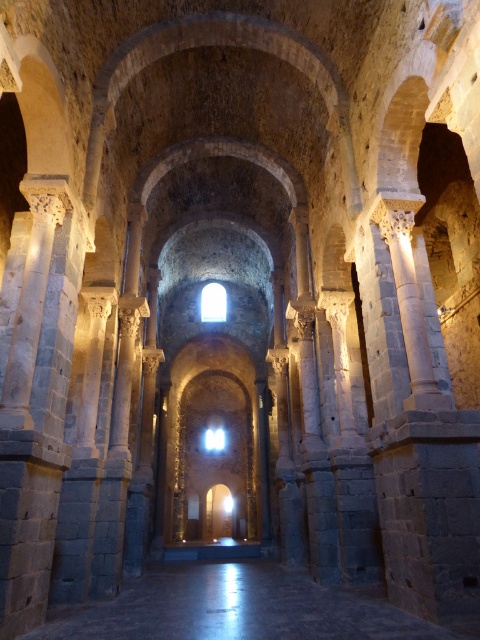
Question: Is the position of dark stone floor at center more distant than that of white glossy light at center?

Choices:
 (A) no
 (B) yes

Answer: (A)

Question: Which of the following is the closest to the observer?

Choices:
 (A) dark stone floor at center
 (B) white glossy light at center

Answer: (A)

Question: Which object appears farthest from the camera in this image?

Choices:
 (A) dark stone floor at center
 (B) white glossy light at center

Answer: (B)

Question: Is dark stone floor at center bigger than white glossy light at center?

Choices:
 (A) no
 (B) yes

Answer: (B)

Question: Does dark stone floor at center lie in front of white glossy light at center?

Choices:
 (A) yes
 (B) no

Answer: (A)

Question: Which of the following is the closest to the observer?

Choices:
 (A) (292, 589)
 (B) (218, 428)

Answer: (A)